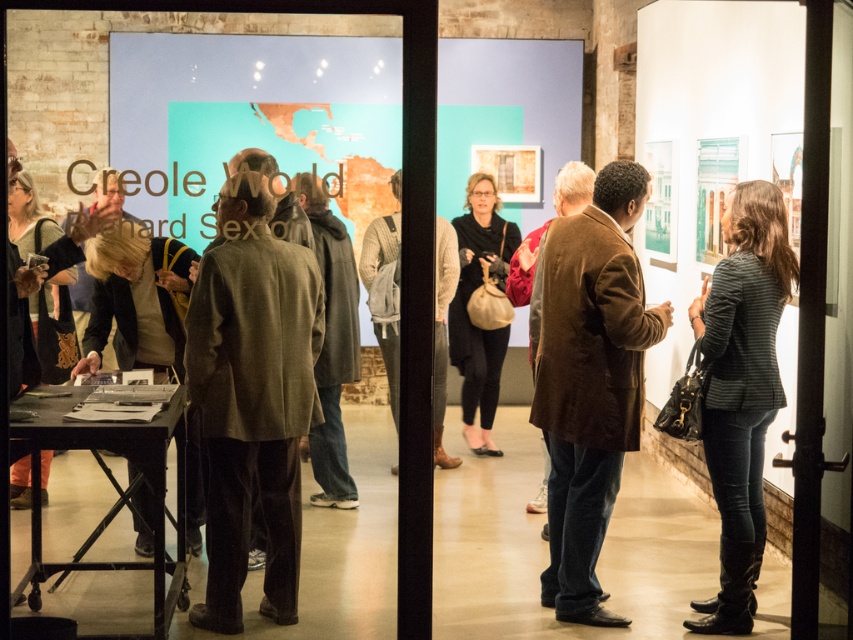
Is dark brown wool coat at center wider than brown suede jacket at center?

No.

Is dark brown wool coat at center thinner than brown suede jacket at center?

Correct, dark brown wool coat at center's width is less than brown suede jacket at center's.

The image size is (853, 640). Describe the element at coordinates (252, 392) in the screenshot. I see `dark brown wool coat at center` at that location.

What are the coordinates of `dark brown wool coat at center` in the screenshot? It's located at (252, 392).

Can you confirm if dark brown leather jacket at left is positioned to the right of matte black dress at center?

Incorrect, dark brown leather jacket at left is not on the right side of matte black dress at center.

The width and height of the screenshot is (853, 640). What do you see at coordinates (136, 300) in the screenshot? I see `dark brown leather jacket at left` at bounding box center [136, 300].

Where is `dark brown leather jacket at left`? Image resolution: width=853 pixels, height=640 pixels. dark brown leather jacket at left is located at coordinates (136, 300).

Does point (196, 301) come in front of point (505, 344)?

Yes, point (196, 301) is in front of point (505, 344).

Looking at this image, can you confirm if dark brown wool coat at center is smaller than matte black dress at center?

Indeed, dark brown wool coat at center has a smaller size compared to matte black dress at center.

Is point (247, 356) less distant than point (451, 320)?

Yes, point (247, 356) is in front of point (451, 320).

Where is `dark brown wool coat at center`? Image resolution: width=853 pixels, height=640 pixels. dark brown wool coat at center is located at coordinates (252, 392).